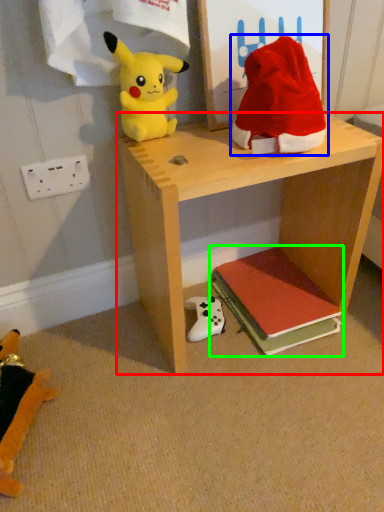
Question: Which is farther away from shelf (highlighted by a red box)? toy (highlighted by a blue box) or book (highlighted by a green box)?

Choices:
 (A) toy
 (B) book

Answer: (B)